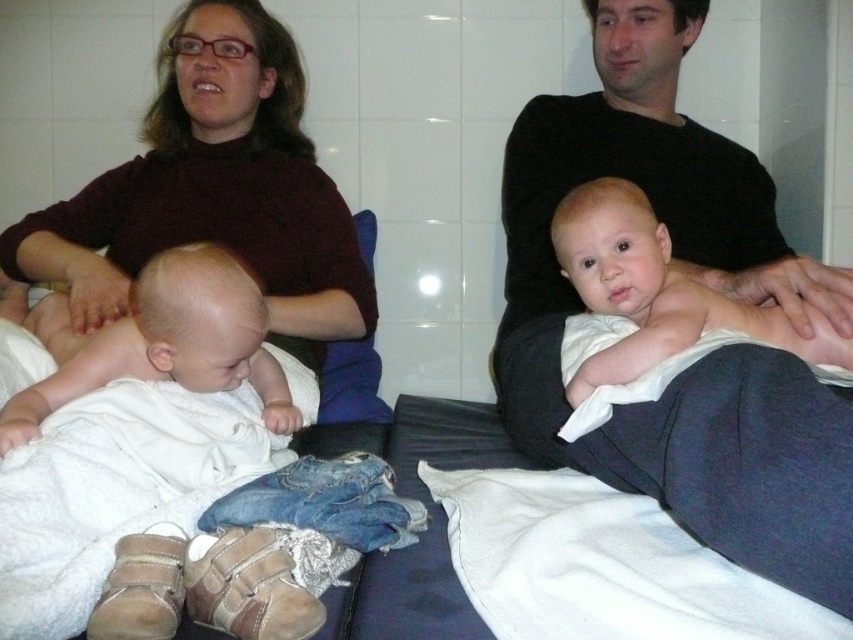
Question: Among these points, which one is farthest from the camera?

Choices:
 (A) (666, 400)
 (B) (628, 301)

Answer: (B)

Question: Which of these objects is positioned closest to the white clothed baby at upper right?

Choices:
 (A) black cotton shirt at upper right
 (B) matte brown sweater at upper left

Answer: (A)

Question: Is matte brown sweater at upper left behind white clothed baby at upper right?

Choices:
 (A) yes
 (B) no

Answer: (A)

Question: Which point is farther to the camera?

Choices:
 (A) (607, 353)
 (B) (314, 346)

Answer: (B)

Question: Considering the relative positions of black cotton shirt at upper right and matte brown sweater at upper left in the image provided, where is black cotton shirt at upper right located with respect to matte brown sweater at upper left?

Choices:
 (A) left
 (B) right

Answer: (B)

Question: Is matte brown sweater at upper left in front of white clothed baby at upper right?

Choices:
 (A) no
 (B) yes

Answer: (A)